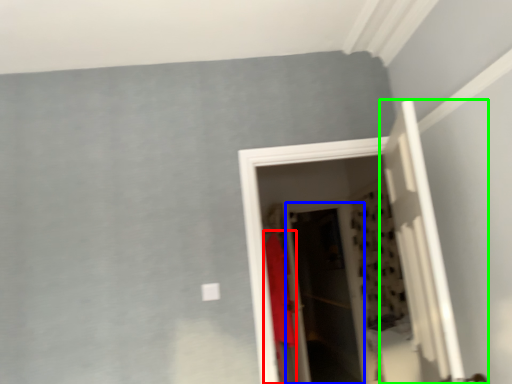
Question: Which object is positioned closest to clothing (highlighted by a red box)? Select from screen door (highlighted by a blue box) and door (highlighted by a green box).

Choices:
 (A) screen door
 (B) door

Answer: (A)